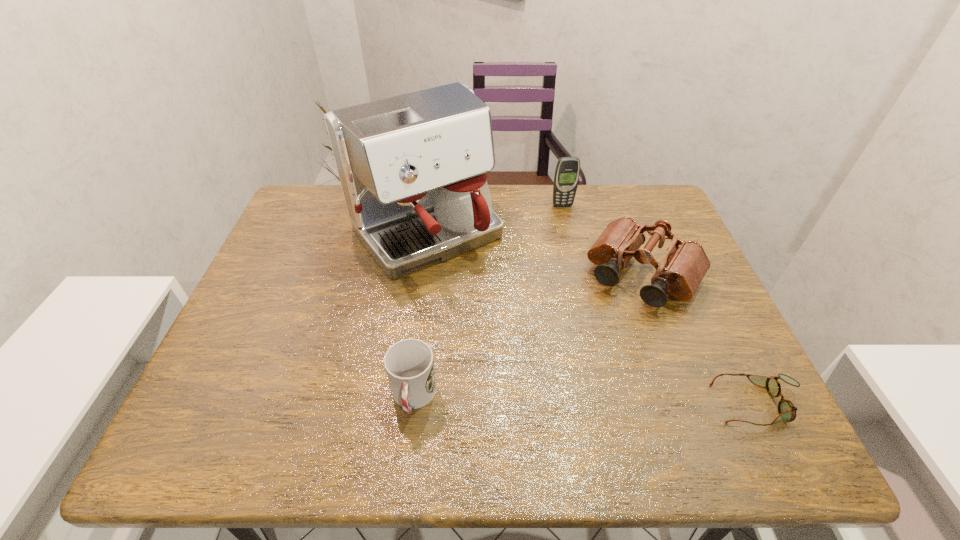
Image resolution: width=960 pixels, height=540 pixels. Find the location of `the fourth tallest object`. the fourth tallest object is located at coordinates [409, 364].

This screenshot has height=540, width=960. I want to click on the shortest object, so click(x=787, y=411).

I want to click on the fourth shortest object, so click(x=567, y=172).

Where is `binoculars`? The image size is (960, 540). binoculars is located at coordinates (684, 265).

Where is `the tallest object`? the tallest object is located at coordinates coord(412,167).

The image size is (960, 540). Identify the location of blank space located on the front-facing side of the shortest object. (637, 404).

Where is `free space located 0.340m on the front-facing side of the shortest object`? The height and width of the screenshot is (540, 960). free space located 0.340m on the front-facing side of the shortest object is located at coordinates (549, 404).

I want to click on free space located on the front-facing side of the shortest object, so pos(642,404).

This screenshot has width=960, height=540. In order to click on vacant space located 0.340m on the screen of the fourth shortest object in this screenshot , I will do `click(590, 286)`.

Image resolution: width=960 pixels, height=540 pixels. Find the location of `vacant space situated 0.180m on the screen of the fourth shortest object`. vacant space situated 0.180m on the screen of the fourth shortest object is located at coordinates (577, 246).